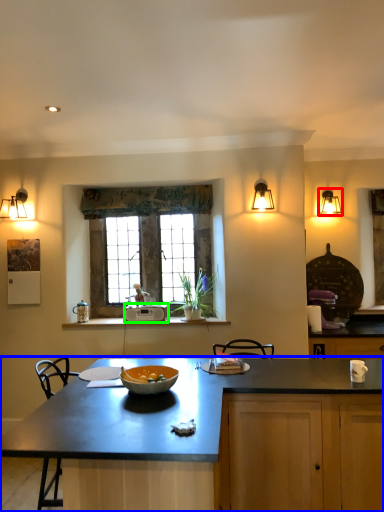
Question: Considering the real-world distances, which object is closest to lamp (highlighted by a red box)? countertop (highlighted by a blue box) or appliance (highlighted by a green box).

Choices:
 (A) countertop
 (B) appliance

Answer: (B)